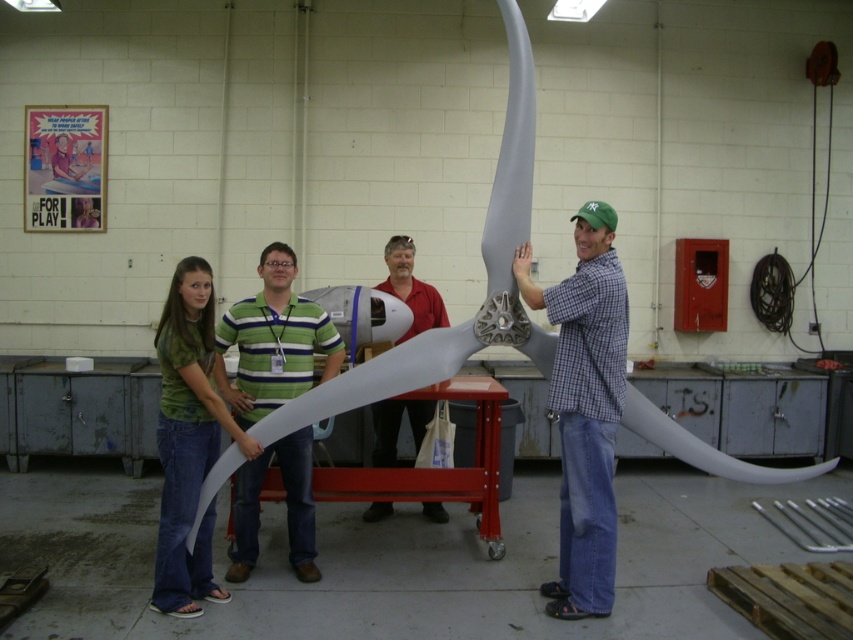
Can you confirm if green matte shirt at center is taller than red smooth shirt at center?

Yes.

Is point (189, 524) farther from viewer compared to point (413, 300)?

No, it is not.

You are a GUI agent. You are given a task and a screenshot of the screen. Output one action in this format:
    pyautogui.click(x=<x>, y=<y>)
    Task: Click on the green matte shirt at center
    Image resolution: width=853 pixels, height=640 pixels.
    Given the screenshot: What is the action you would take?
    (189, 440)

The width and height of the screenshot is (853, 640). I want to click on green matte shirt at center, so click(x=189, y=440).

Who is positioned more to the left, checkered fabric shirt at center or green matte shirt at center?

Positioned to the left is green matte shirt at center.

Does checkered fabric shirt at center appear on the right side of green matte shirt at center?

Correct, you'll find checkered fabric shirt at center to the right of green matte shirt at center.

Who is more forward, (561,336) or (202,310)?

Point (202,310) is more forward.

You are a GUI agent. You are given a task and a screenshot of the screen. Output one action in this format:
    pyautogui.click(x=<x>, y=<y>)
    Task: Click on the checkered fabric shirt at center
    
    Given the screenshot: What is the action you would take?
    pyautogui.click(x=584, y=406)

Between green striped shirt at center and red smooth shirt at center, which one is positioned higher?

green striped shirt at center is higher up.

Can you confirm if green striped shirt at center is wider than red smooth shirt at center?

Yes.

Is point (306, 509) farther from camera compared to point (370, 406)?

No, it is not.

The width and height of the screenshot is (853, 640). What are the coordinates of `green striped shirt at center` in the screenshot? It's located at (273, 340).